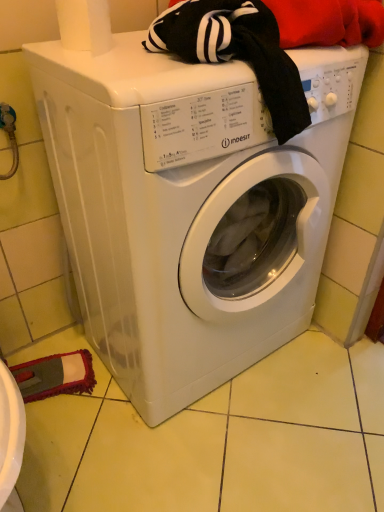
This screenshot has width=384, height=512. What do you see at coordinates (189, 208) in the screenshot?
I see `white plastic washing machine at center` at bounding box center [189, 208].

In order to face white plastic washing machine at center, should I rotate leftwards or rightwards?

Turn right approximately 0.193 degrees to face it.

The height and width of the screenshot is (512, 384). Identify the location of white plastic washing machine at center. (189, 208).

The image size is (384, 512). What do you see at coordinates (85, 25) in the screenshot? I see `white paper towel at upper left` at bounding box center [85, 25].

What is the approximate width of white paper towel at upper left?

6.15 inches.

Where is `white paper towel at upper left`? This screenshot has width=384, height=512. white paper towel at upper left is located at coordinates (85, 25).

Measure the distance between white paper towel at upper left and camera.

white paper towel at upper left and camera are 29.78 inches apart from each other.

Identify the location of white plastic washing machine at center. Image resolution: width=384 pixels, height=512 pixels. tap(189, 208).

Which is more to the right, white plastic washing machine at center or white paper towel at upper left?

white plastic washing machine at center.

Is white plastic washing machine at center positioned in front of white paper towel at upper left?

Yes, white plastic washing machine at center is in front of white paper towel at upper left.

Looking at this image, which point is more forward, (124,242) or (98,21)?

The point (124,242) is closer to the camera.

From the image's perspective, is white plastic washing machine at center located above or below white paper towel at upper left?

From the image's perspective, white plastic washing machine at center appears below white paper towel at upper left.

From a real-world perspective, is white plastic washing machine at center above or below white paper towel at upper left?

From a real-world perspective, white plastic washing machine at center is physically below white paper towel at upper left.

Between white plastic washing machine at center and white paper towel at upper left, which one has larger width?

Wider between the two is white plastic washing machine at center.

From their relative heights in the image, would you say white plastic washing machine at center is taller or shorter than white paper towel at upper left?

white plastic washing machine at center is taller than white paper towel at upper left.

Which of these two, white plastic washing machine at center or white paper towel at upper left, is bigger?

white plastic washing machine at center is bigger.

Is white plastic washing machine at center inside the boundaries of white paper towel at upper left, or outside?

white plastic washing machine at center is spatially situated outside white paper towel at upper left.

Is white plastic washing machine at center touching white paper towel at upper left?

There is a gap between white plastic washing machine at center and white paper towel at upper left.

Consider the image. Is white plastic washing machine at center oriented towards white paper towel at upper left?

No, white plastic washing machine at center is not turned towards white paper towel at upper left.

In the scene shown: What's the angular difference between white plastic washing machine at center and white paper towel at upper left's facing directions?

4.17e-05 degrees.

This screenshot has width=384, height=512. In order to click on toilet paper on the left of white plastic washing machine at center in this screenshot , I will do `click(85, 25)`.

Is white paper towel at upper left at the right side of white plastic washing machine at center?

Incorrect, white paper towel at upper left is not on the right side of white plastic washing machine at center.

Between white paper towel at upper left and white plastic washing machine at center, which one is positioned in front?

white plastic washing machine at center is in front.

Does point (109, 41) come closer to viewer compared to point (257, 302)?

Yes, it is.

From the image's perspective, between white paper towel at upper left and white plastic washing machine at center, which one is located above?

white paper towel at upper left.

From a real-world perspective, does white paper towel at upper left stand above white plastic washing machine at center?

Correct, in the physical world, white paper towel at upper left is higher than white plastic washing machine at center.

Is white paper towel at upper left wider than white plastic washing machine at center?

No.

Considering the sizes of white paper towel at upper left and white plastic washing machine at center in the image, is white paper towel at upper left taller or shorter than white plastic washing machine at center?

Clearly, white paper towel at upper left is shorter compared to white plastic washing machine at center.

Considering the relative sizes of white paper towel at upper left and white plastic washing machine at center in the image provided, is white paper towel at upper left smaller than white plastic washing machine at center?

Yes.

Consider the image. Is white plastic washing machine at center completely or partially inside white paper towel at upper left?

Definitely not — white plastic washing machine at center is not inside white paper towel at upper left.

Are white paper towel at upper left and white plastic washing machine at center far apart?

white paper towel at upper left is actually quite close to white plastic washing machine at center.

Is white paper towel at upper left facing away from white plastic washing machine at center?

No.

In the image, there is a white paper towel at upper left. At what (x,y) coordinates should I click in order to perform the action: click on washing machine below it (from a real-world perspective). Please return your answer as a coordinate pair (x, y). Looking at the image, I should click on (189, 208).

Identify the location of toilet paper behind the white plastic washing machine at center. This screenshot has height=512, width=384. (85, 25).

Find the location of a particular element. The height and width of the screenshot is (512, 384). toilet paper to the left of white plastic washing machine at center is located at coordinates (85, 25).